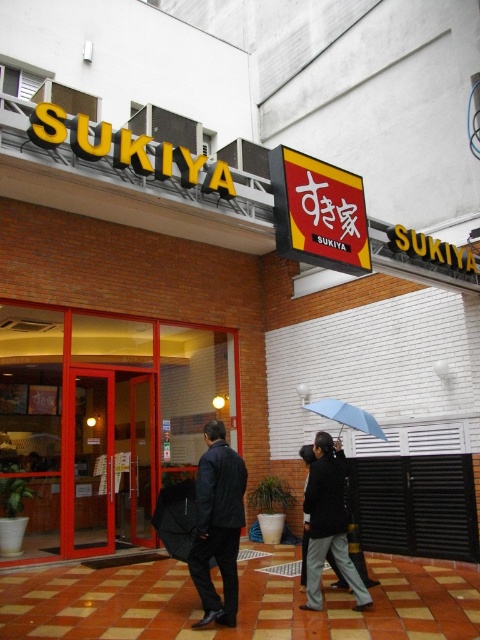
Is point (331, 477) farther from viewer compared to point (343, 413)?

No, (331, 477) is closer to viewer.

Which is below, dark gray fabric jacket at center or blue matte umbrella at center?

dark gray fabric jacket at center is lower down.

Identify the location of dark gray fabric jacket at center. (328, 522).

Is black matte umbrella at center shorter than blue matte umbrella at center?

No, black matte umbrella at center is not shorter than blue matte umbrella at center.

Locate an element on the screen. This screenshot has width=480, height=640. black matte umbrella at center is located at coordinates (176, 516).

Locate an element on the screen. black matte umbrella at center is located at coordinates click(176, 516).

Is matte plastic sign at upper center in front of black matte umbrella at center?

No, it is behind black matte umbrella at center.

Between matte plastic sign at upper center and black matte umbrella at center, which one has less height?

With less height is black matte umbrella at center.

Which is behind, point (336, 256) or point (190, 486)?

The point (336, 256) is more distant.

This screenshot has width=480, height=640. Identify the location of matte plastic sign at upper center. (319, 212).